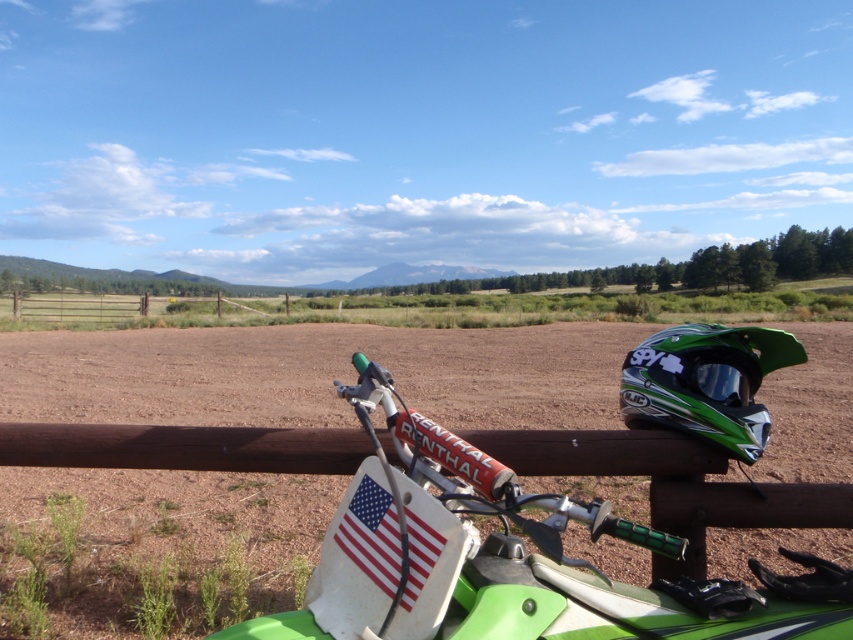
Consider the image. You are a photographer setting up a shot of the green matte motorcycle handlebars at center and the american flag sticker at lower center. You want to ensure both are in focus. Which object should you adjust your camera focus on first to account for their size difference?

The green matte motorcycle handlebars at center is much taller than the american flag sticker at lower center, so you should focus on the taller object first to ensure depth of field covers both.

You are a mechanic inspecting a dirt bike. You need to reach the american flag sticker at lower center while holding a tool that is 4 inches long. Can you comfortably reach it from the green matte motorcycle handlebars at center without moving your position?

The distance between the green matte motorcycle handlebars at center and the american flag sticker at lower center is 3.52 inches. Since the tool is 4 inches long, you can comfortably reach the american flag sticker at lower center from the green matte motorcycle handlebars at center without moving your position.